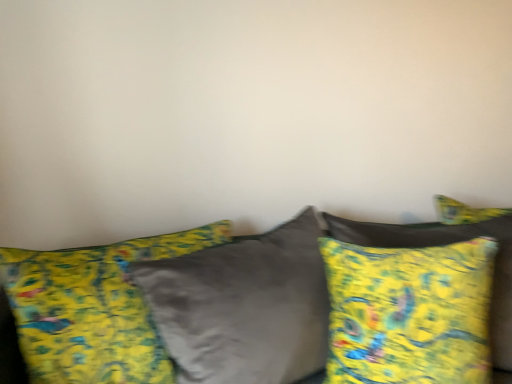
Question: Is yellow fabric pillow at right, the second pillow from the left, inside yellow fabric pillow at center, the 1th pillow in the left-to-right sequence?

Choices:
 (A) yes
 (B) no

Answer: (B)

Question: From a real-world perspective, is yellow fabric pillow at center, acting as the second pillow starting from the right, positioned under yellow fabric pillow at right, the second pillow from the left, based on gravity?

Choices:
 (A) no
 (B) yes

Answer: (B)

Question: Considering the relative sizes of yellow fabric pillow at center, the 1th pillow in the left-to-right sequence, and yellow fabric pillow at right, the second pillow from the left, in the image provided, is yellow fabric pillow at center, the 1th pillow in the left-to-right sequence, bigger than yellow fabric pillow at right, the second pillow from the left,?

Choices:
 (A) no
 (B) yes

Answer: (B)

Question: Is yellow fabric pillow at center, acting as the second pillow starting from the right, positioned beyond the bounds of yellow fabric pillow at right, the first pillow positioned from the right?

Choices:
 (A) no
 (B) yes

Answer: (B)

Question: Does yellow fabric pillow at center, the 1th pillow in the left-to-right sequence, appear on the right side of yellow fabric pillow at right, the second pillow from the left?

Choices:
 (A) no
 (B) yes

Answer: (A)

Question: Choose the correct answer: Is velvet yellow pillows at center inside yellow fabric pillow at center, acting as the second pillow starting from the right, or outside it?

Choices:
 (A) inside
 (B) outside

Answer: (B)

Question: From the image's perspective, is velvet yellow pillows at center positioned above or below yellow fabric pillow at center, the 1th pillow in the left-to-right sequence?

Choices:
 (A) above
 (B) below

Answer: (B)

Question: From their relative heights in the image, would you say velvet yellow pillows at center is taller or shorter than yellow fabric pillow at center, the 1th pillow in the left-to-right sequence?

Choices:
 (A) short
 (B) tall

Answer: (A)

Question: Based on their sizes in the image, would you say velvet yellow pillows at center is bigger or smaller than yellow fabric pillow at center, acting as the second pillow starting from the right?

Choices:
 (A) small
 (B) big

Answer: (B)

Question: Looking at the image, does yellow fabric pillow at center, the 1th pillow in the left-to-right sequence, seem bigger or smaller compared to yellow fabric pillow at right, the first pillow positioned from the right?

Choices:
 (A) small
 (B) big

Answer: (B)

Question: Is yellow fabric pillow at center, acting as the second pillow starting from the right, taller or shorter than yellow fabric pillow at right, the first pillow positioned from the right?

Choices:
 (A) tall
 (B) short

Answer: (A)

Question: Does point (126, 344) appear closer or farther from the camera than point (402, 238)?

Choices:
 (A) closer
 (B) farther

Answer: (A)

Question: In the image, is yellow fabric pillow at center, the 1th pillow in the left-to-right sequence, on the left side or the right side of yellow fabric pillow at right, the first pillow positioned from the right?

Choices:
 (A) left
 (B) right

Answer: (A)

Question: Based on their positions, is yellow fabric pillow at center, the 1th pillow in the left-to-right sequence, located to the left or right of velvet yellow pillows at center?

Choices:
 (A) right
 (B) left

Answer: (B)

Question: Looking at their shapes, would you say yellow fabric pillow at center, the 1th pillow in the left-to-right sequence, is wider or thinner than velvet yellow pillows at center?

Choices:
 (A) thin
 (B) wide

Answer: (A)